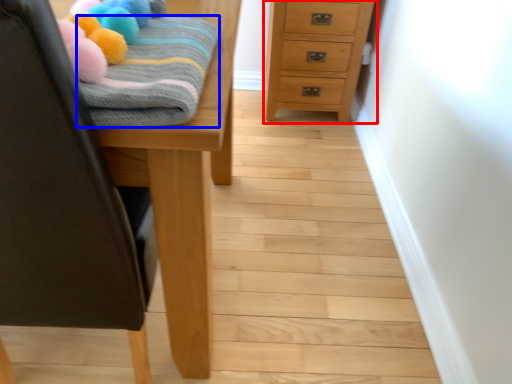
Question: Among these objects, which one is nearest to the camera, chest of drawers (highlighted by a red box) or bath towel (highlighted by a blue box)?

Choices:
 (A) chest of drawers
 (B) bath towel

Answer: (B)